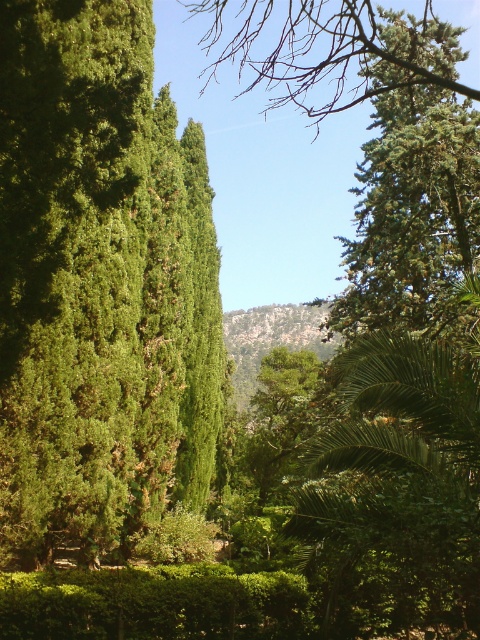
Question: In this image, where is green leafy tree at left located relative to green leafy hedge at center?

Choices:
 (A) right
 (B) left

Answer: (B)

Question: Is green leafy tree at left bigger than green leafy hedge at center?

Choices:
 (A) no
 (B) yes

Answer: (B)

Question: Does green leafy tree at left appear on the left side of green leafy hedge at center?

Choices:
 (A) yes
 (B) no

Answer: (A)

Question: Which point is closer to the camera taking this photo?

Choices:
 (A) (15, 416)
 (B) (34, 596)

Answer: (B)